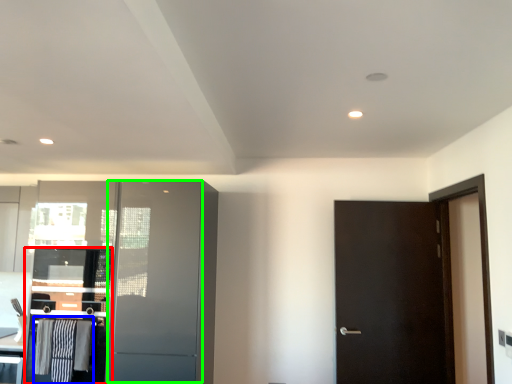
Question: Estimate the real-world distances between objects in this image. Which object is farther from cabinetry (highlighted by a red box), laundry (highlighted by a blue box) or screen door (highlighted by a green box)?

Choices:
 (A) laundry
 (B) screen door

Answer: (B)